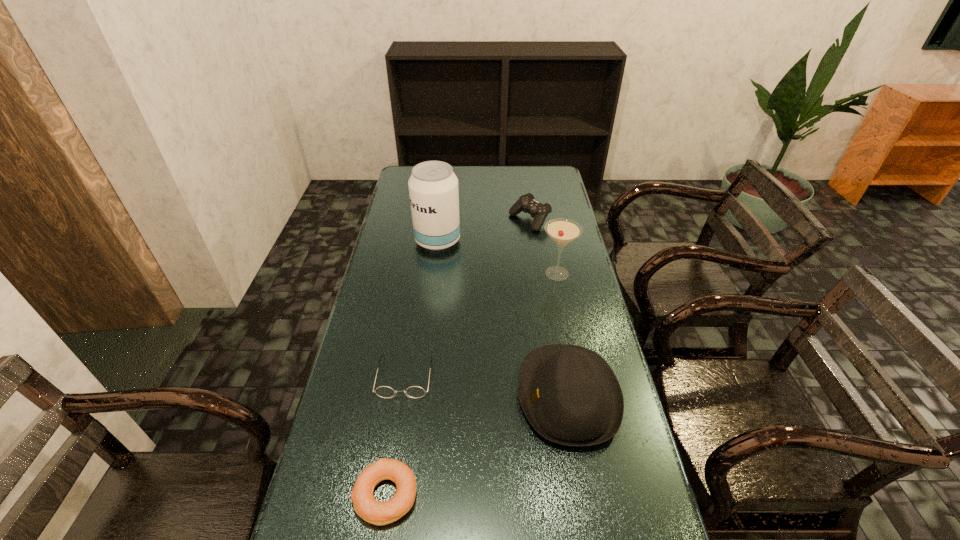
Locate an element on the screen. The width and height of the screenshot is (960, 540). alcohol is located at coordinates (433, 187).

This screenshot has width=960, height=540. What are the coordinates of `the third farthest object` in the screenshot? It's located at (562, 231).

At what (x,y) coordinates should I click in order to perform the action: click on martini. Please return your answer as a coordinate pair (x, y). The height and width of the screenshot is (540, 960). Looking at the image, I should click on (562, 231).

At what (x,y) coordinates should I click in order to perform the action: click on the fourth shortest object. Please return your answer as a coordinate pair (x, y). The width and height of the screenshot is (960, 540). Looking at the image, I should click on (570, 395).

At what (x,y) coordinates should I click in order to perform the action: click on the third shortest object. Please return your answer as a coordinate pair (x, y). This screenshot has width=960, height=540. Looking at the image, I should click on (526, 203).

At what (x,y) coordinates should I click in order to perform the action: click on spectacles. Please return your answer as a coordinate pair (x, y). The width and height of the screenshot is (960, 540). Looking at the image, I should click on (383, 391).

Identify the location of the nearest object. (365, 505).

Where is `vacant space located on the right of the tallest object`? The width and height of the screenshot is (960, 540). vacant space located on the right of the tallest object is located at coordinates (515, 241).

Find the location of a particular element. The image size is (960, 540). vacant area situated 0.230m on the back of the martini is located at coordinates (547, 226).

The image size is (960, 540). In order to click on vacant space situated on the front-facing side of the third tallest object in this screenshot , I will do `click(439, 396)`.